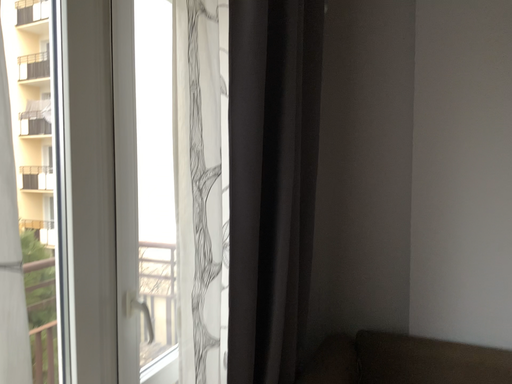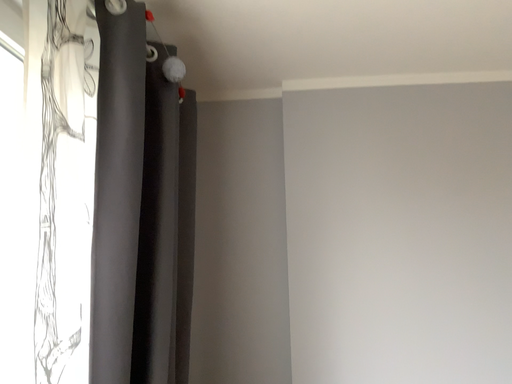
Question: How did the camera likely rotate when shooting the video?

Choices:
 (A) rotated upward
 (B) rotated downward

Answer: (A)